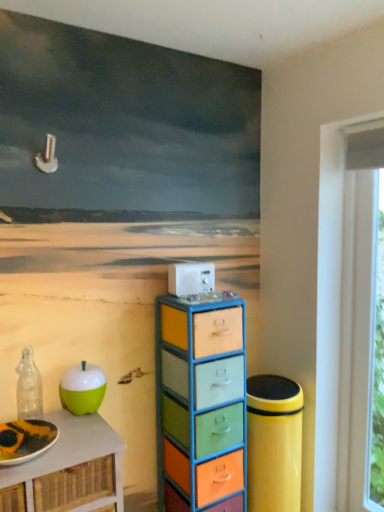
Question: Visually, is green matte apple at lower left positioned to the left or to the right of matte white plate at lower left?

Choices:
 (A) left
 (B) right

Answer: (B)

Question: Considering the positions of green matte apple at lower left and matte white plate at lower left in the image, is green matte apple at lower left wider or thinner than matte white plate at lower left?

Choices:
 (A) wide
 (B) thin

Answer: (B)

Question: Which is farther from the green matte apple at left?

Choices:
 (A) matte white plate at lower left
 (B) green matte apple at lower left
 (C) transparent glass bottle at left
 (D) multicolored painted drawers at center
 (E) white plastic appliance at center

Answer: (E)

Question: Based on their relative distances, which object is farther from the multicolored painted drawers at center?

Choices:
 (A) matte white plate at lower left
 (B) green matte apple at lower left
 (C) green matte apple at left
 (D) white plastic window frame at right
 (E) transparent glass bottle at left

Answer: (A)